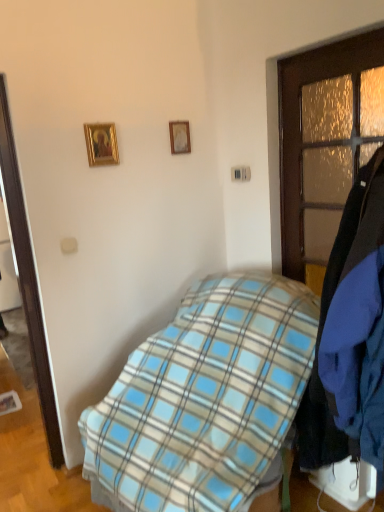
Question: Is wooden picture frame at upper center, the 1th picture frame in the right-to-left sequence, bigger or smaller than blue plaid blanket at center?

Choices:
 (A) small
 (B) big

Answer: (A)

Question: Considering their positions, is wooden picture frame at upper center, the 2th picture frame from the left, located in front of or behind blue plaid blanket at center?

Choices:
 (A) behind
 (B) front

Answer: (A)

Question: Considering the real-world distances, which object is farthest from the blue plaid blanket at center?

Choices:
 (A) wooden picture frame at upper center, the 2th picture frame from the left
 (B) wooden door at right
 (C) gold-framed picture at upper left, the first picture frame when ordered from left to right

Answer: (A)

Question: Based on their relative distances, which object is farther from the wooden picture frame at upper center, the 1th picture frame in the back-to-front sequence?

Choices:
 (A) blue plaid blanket at center
 (B) gold-framed picture at upper left, the first picture frame when ordered from left to right
 (C) wooden door at right

Answer: (A)